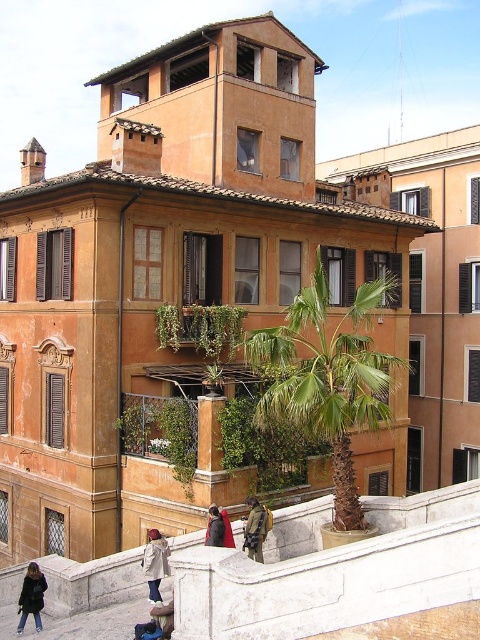
Question: Is green leafy palm at center smaller than dark brown leather jacket at lower left?

Choices:
 (A) no
 (B) yes

Answer: (A)

Question: Estimate the real-world distances between objects in this image. Which object is closer to the dark brown leather jacket at lower left?

Choices:
 (A) khaki fabric jacket at center
 (B) green leafy palm at center

Answer: (A)

Question: Estimate the real-world distances between objects in this image. Which object is farther from the green leafy palm at center?

Choices:
 (A) khaki fabric jacket at center
 (B) dark brown leather jacket at lower left

Answer: (B)

Question: Does green leafy plants at center appear over dark brown leather jacket at lower left?

Choices:
 (A) no
 (B) yes

Answer: (B)

Question: From the image, what is the correct spatial relationship of dark brown leather jacket at lower left in relation to khaki fabric jacket at center?

Choices:
 (A) left
 (B) right

Answer: (A)

Question: Which object is farther from the camera taking this photo?

Choices:
 (A) green leafy plants at center
 (B) green leafy palm at center
 (C) light beige coat at lower center

Answer: (A)